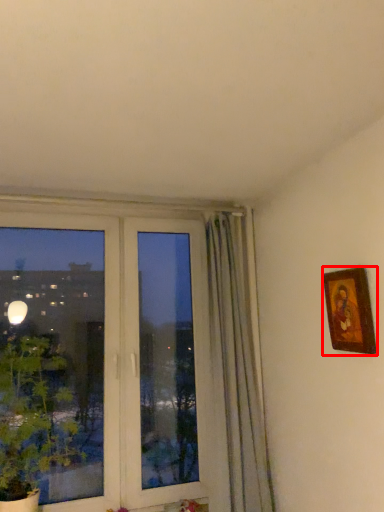
Question: From the image's perspective, considering the relative positions of picture frame (annotated by the red box) and plant in the image provided, where is picture frame (annotated by the red box) located with respect to the staircase?

Choices:
 (A) below
 (B) above

Answer: (B)